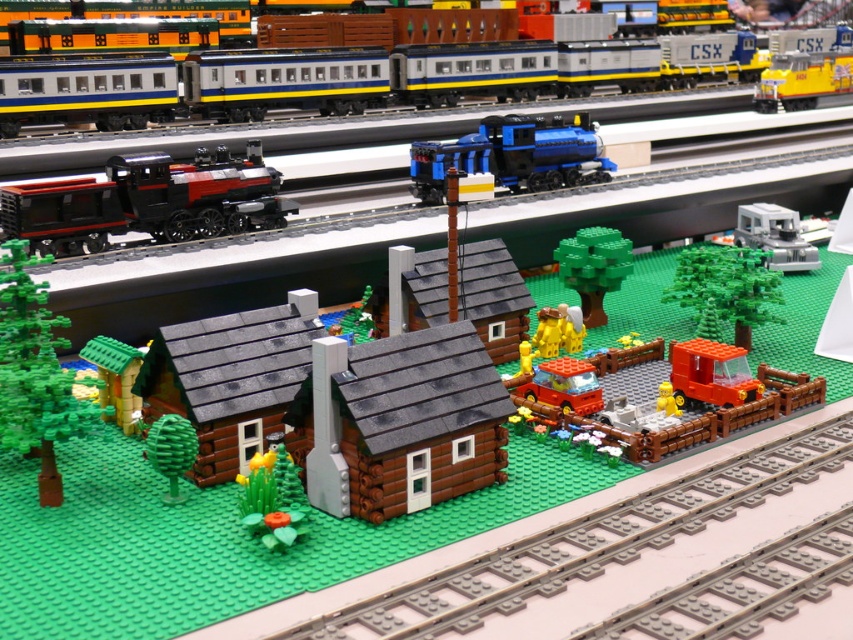
Looking at this image, you are standing in the Lego railway scene and want to place a new Lego piece. You have two points to choose from, point 1 at point (247, 188) and point 2 at point (492, 157). Which point is closer to you?

Point 1 at point (247, 188) is closer to you than point 2 at point (492, 157).

You are a toy collector examining the Lego diorama. You see the brushed metal train at upper center and the black matte train at left. Which train is positioned to the right side of the other?

The brushed metal train at upper center is positioned to the right of the black matte train at left.

You are a passenger waiting at the Lego railway station. You see the black matte train at left and the blue metallic train at center. Which train is closer to the ground?

The black matte train at left is located below the blue metallic train at center, so it is closer to the ground.